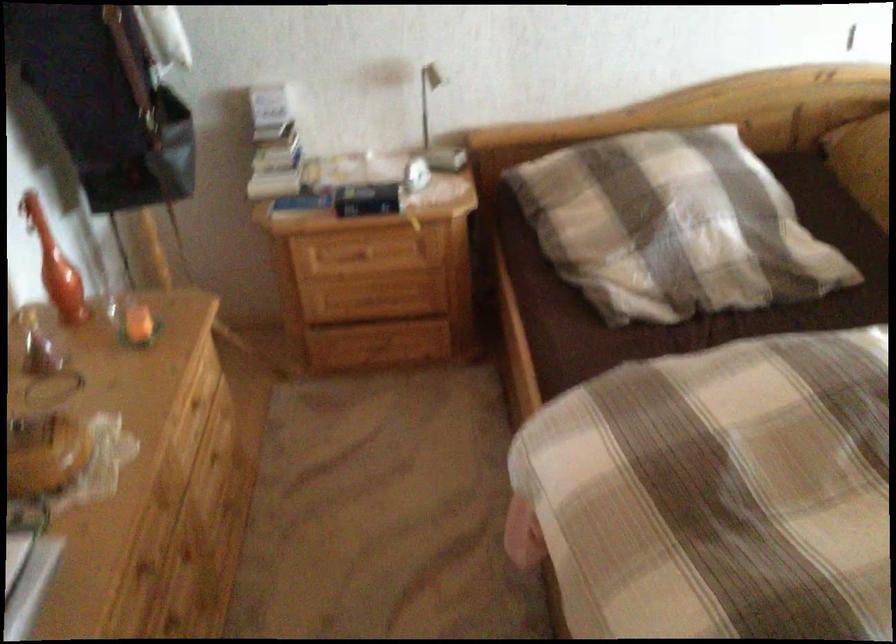
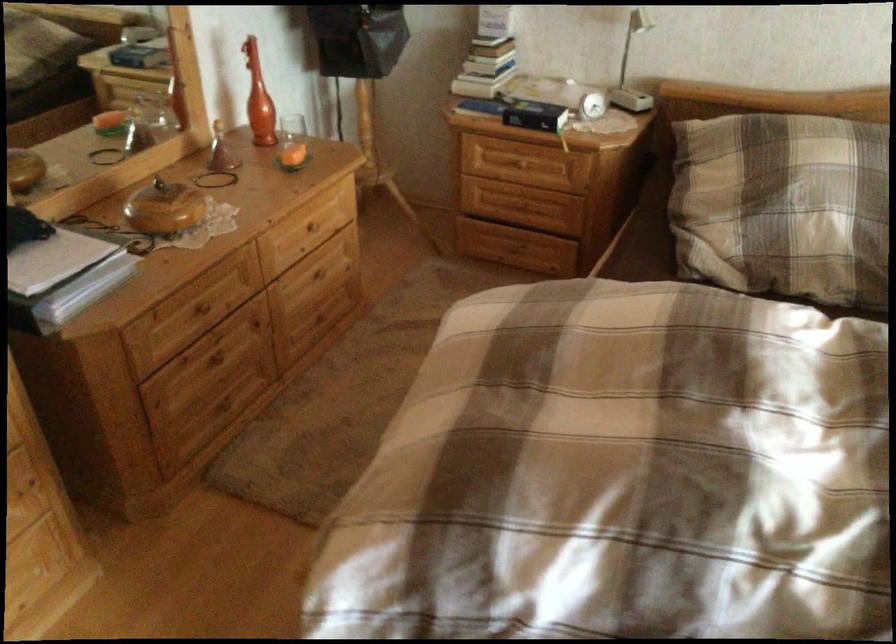
Locate, in the second image, the point that corresponds to the point at 668,228 in the first image.

(782, 205)